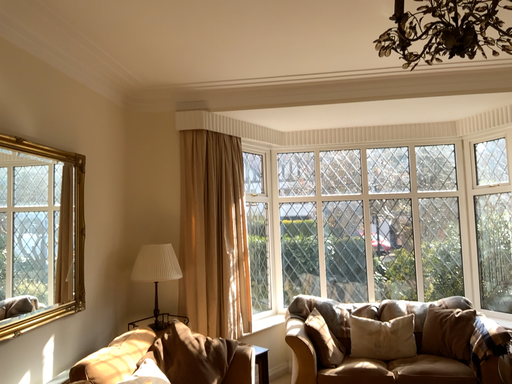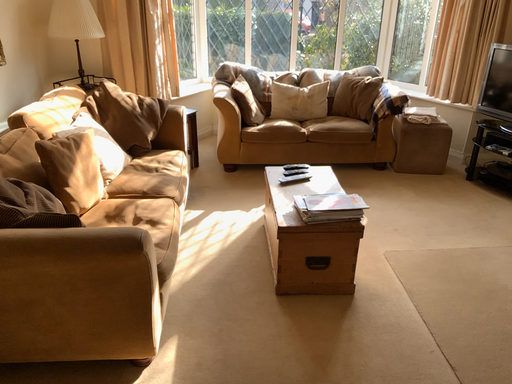
Question: Which way did the camera rotate in the video?

Choices:
 (A) rotated left
 (B) rotated right

Answer: (B)